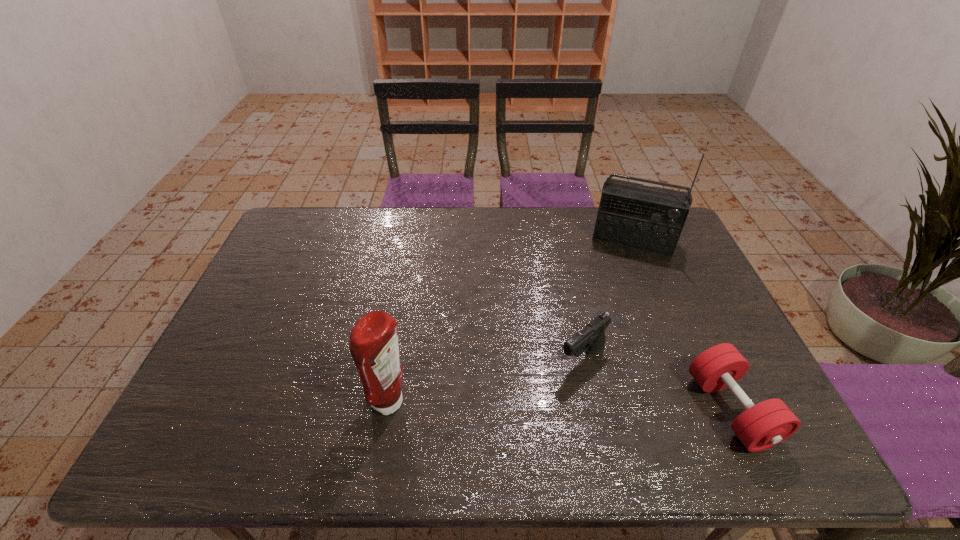
Identify the location of condiment. (374, 347).

Locate an element on the screen. This screenshot has width=960, height=540. the leftmost object is located at coordinates tap(374, 347).

Image resolution: width=960 pixels, height=540 pixels. Identify the location of dumbbell. (761, 426).

Identify the location of the second object from left to right. (591, 338).

At what (x,y) coordinates should I click in order to perform the action: click on radio receiver. Please return your answer as a coordinate pair (x, y). The height and width of the screenshot is (540, 960). Looking at the image, I should click on (651, 219).

Locate an element on the screen. Image resolution: width=960 pixels, height=540 pixels. the farthest object is located at coordinates (651, 219).

In order to click on free region located on the right of the condiment in this screenshot , I will do `click(511, 403)`.

Where is `vacant space situated on the back of the dumbbell`? This screenshot has height=540, width=960. vacant space situated on the back of the dumbbell is located at coordinates (685, 310).

Find the location of a particular element. This screenshot has height=540, width=960. free space located 0.150m at the barrel of the third object from right to left is located at coordinates (524, 407).

Locate an element on the screen. Image resolution: width=960 pixels, height=540 pixels. blank area located at the barrel of the third object from right to left is located at coordinates (541, 393).